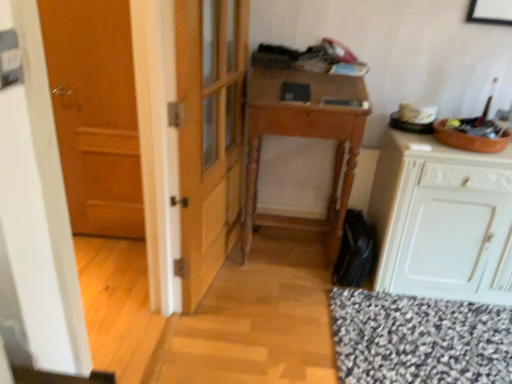
Where is `vacant area situated below wooden desk at center (from a real-world perspective)`? vacant area situated below wooden desk at center (from a real-world perspective) is located at coordinates (296, 251).